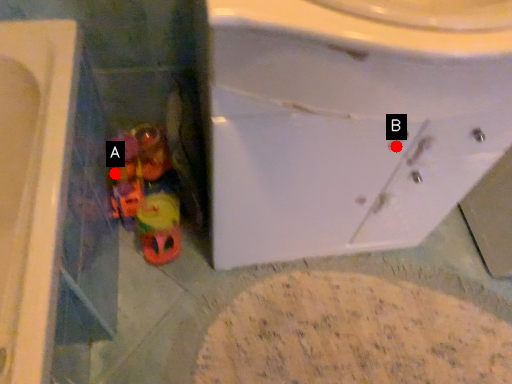
Question: Two points are circled on the image, labeled by A and B beside each circle. Which point is closer to the camera taking this photo?

Choices:
 (A) A is closer
 (B) B is closer

Answer: (B)